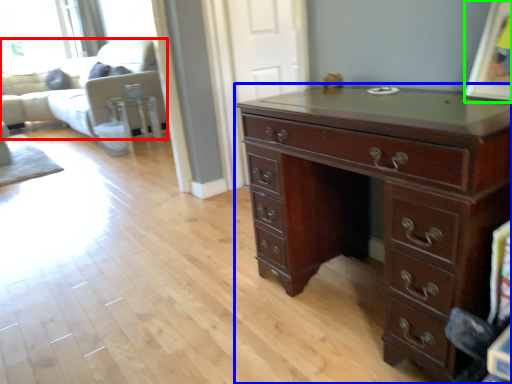
Question: Estimate the real-world distances between objects in this image. Which object is closer to couch (highlighted by a red box), chest of drawers (highlighted by a blue box) or picture frame (highlighted by a green box)?

Choices:
 (A) chest of drawers
 (B) picture frame

Answer: (A)